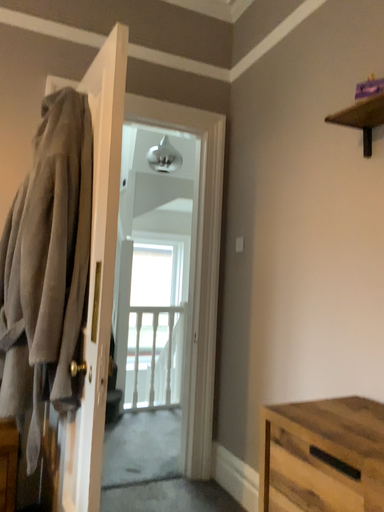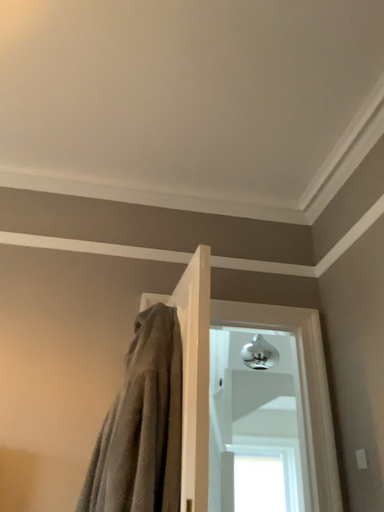
Question: Which way did the camera rotate in the video?

Choices:
 (A) rotated upward
 (B) rotated downward

Answer: (A)